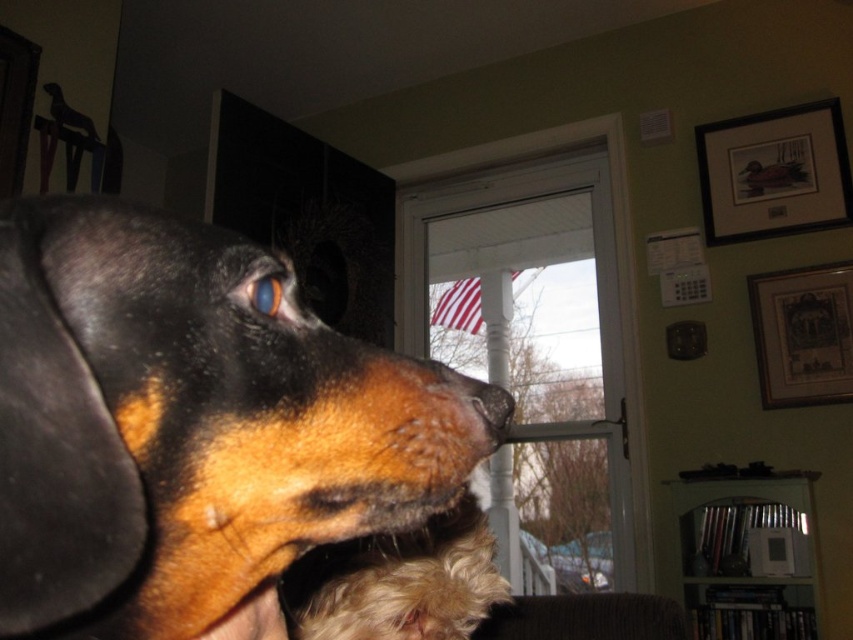
Is clear glass window at center above black matte nose at center?

No.

Describe the element at coordinates (538, 352) in the screenshot. The height and width of the screenshot is (640, 853). I see `clear glass window at center` at that location.

Image resolution: width=853 pixels, height=640 pixels. I want to click on clear glass window at center, so click(538, 352).

Between black matte nose at center and blue glossy eye at upper center, which one has more height?

black matte nose at center is taller.

Is point (490, 394) positioned in front of point (265, 292)?

That is False.

Where is `black matte nose at center`? The height and width of the screenshot is (640, 853). black matte nose at center is located at coordinates (492, 404).

Describe the element at coordinates (538, 352) in the screenshot. This screenshot has height=640, width=853. I see `clear glass window at center` at that location.

Between point (544, 253) and point (262, 314), which one is positioned in front?

Point (262, 314)

Is point (566, 500) farther from camera compared to point (283, 285)?

Yes, it is behind point (283, 285).

The height and width of the screenshot is (640, 853). In order to click on clear glass window at center in this screenshot , I will do `click(538, 352)`.